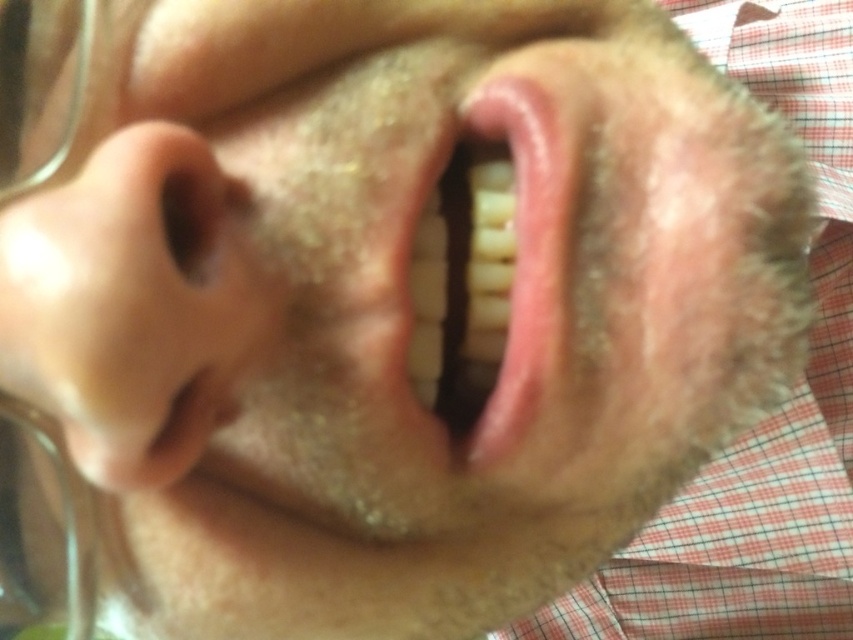
Question: Does smooth skin nose at left appear on the left side of pink glossy lips at center?

Choices:
 (A) yes
 (B) no

Answer: (A)

Question: Which of the following is the farthest from the observer?

Choices:
 (A) (20, 243)
 (B) (476, 436)

Answer: (B)

Question: Is smooth skin nose at left positioned at the back of pink glossy lips at center?

Choices:
 (A) yes
 (B) no

Answer: (B)

Question: Which point is closer to the camera?

Choices:
 (A) smooth skin nose at left
 (B) pink glossy lips at center

Answer: (A)

Question: Does smooth skin nose at left have a lesser width compared to pink glossy lips at center?

Choices:
 (A) yes
 (B) no

Answer: (B)